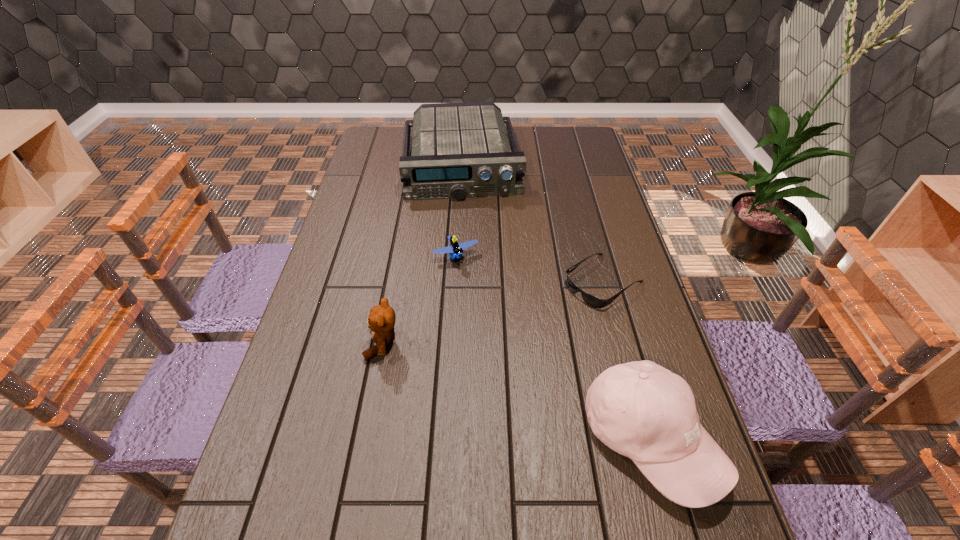
This screenshot has height=540, width=960. I want to click on teddy bear, so click(x=381, y=321).

You are a GUI agent. You are given a task and a screenshot of the screen. Output one action in this format:
    pyautogui.click(x=<x>, y=<y>)
    Task: Click on the baseball cap
    The image size is (960, 540).
    Given the screenshot: What is the action you would take?
    pyautogui.click(x=639, y=409)

Find the location of `the tallest object`. the tallest object is located at coordinates (639, 409).

At what (x,y) coordinates should I click in order to perform the action: click on radio receiver. Please return your answer as a coordinate pair (x, y). The width and height of the screenshot is (960, 540). Looking at the image, I should click on (459, 150).

Where is `the shortest object`? The width and height of the screenshot is (960, 540). the shortest object is located at coordinates (591, 300).

Find the location of `Lego`. Lego is located at coordinates click(455, 250).

You are a GUI agent. You are given a task and a screenshot of the screen. Output one action in this format:
    pyautogui.click(x=<x>, y=<y>)
    Task: Click on the free spot located 0.070m on the front-facing side of the second nearest object
    This screenshot has width=960, height=540.
    Given the screenshot: What is the action you would take?
    pyautogui.click(x=338, y=343)

What are the coordinates of `vacant space positioned 0.110m on the front-facing side of the second nearest object` in the screenshot? It's located at (323, 343).

Locate an element on the screen. The image size is (960, 540). blank space located on the front-facing side of the second nearest object is located at coordinates (326, 343).

Where is `free point located 0.130m on the front panel of the radio receiver`? Image resolution: width=960 pixels, height=540 pixels. free point located 0.130m on the front panel of the radio receiver is located at coordinates (466, 226).